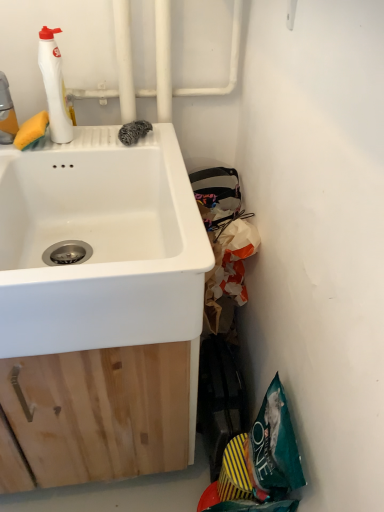
Question: Is teal fabric bag at lower right further to camera compared to translucent white bottle at upper left, which is the 1th cleaning product from left to right?

Choices:
 (A) no
 (B) yes

Answer: (B)

Question: Does teal fabric bag at lower right have a greater width compared to translucent white bottle at upper left, which ranks as the 2th cleaning product in right-to-left order?

Choices:
 (A) no
 (B) yes

Answer: (A)

Question: Is teal fabric bag at lower right smaller than translucent white bottle at upper left, which is the 1th cleaning product from left to right?

Choices:
 (A) no
 (B) yes

Answer: (A)

Question: Can you confirm if teal fabric bag at lower right is shorter than translucent white bottle at upper left, which is the 1th cleaning product from left to right?

Choices:
 (A) no
 (B) yes

Answer: (A)

Question: From the image's perspective, is teal fabric bag at lower right over translucent white bottle at upper left, which is the 1th cleaning product from left to right?

Choices:
 (A) yes
 (B) no

Answer: (B)

Question: Is teal fabric bag at lower right closer to camera compared to translucent white bottle at upper left, which is the 1th cleaning product from left to right?

Choices:
 (A) no
 (B) yes

Answer: (A)

Question: From the image's perspective, is white matte bottle at upper left, which ranks as the second cleaning product in left-to-right order, beneath teal fabric bag at lower right?

Choices:
 (A) yes
 (B) no

Answer: (B)

Question: From the image's perspective, does white matte bottle at upper left, which is the first cleaning product in right-to-left order, appear higher than teal fabric bag at lower right?

Choices:
 (A) yes
 (B) no

Answer: (A)

Question: Is white matte bottle at upper left, which ranks as the second cleaning product in left-to-right order, to the right of teal fabric bag at lower right from the viewer's perspective?

Choices:
 (A) no
 (B) yes

Answer: (A)

Question: Is white matte bottle at upper left, which is the first cleaning product in right-to-left order, outside teal fabric bag at lower right?

Choices:
 (A) no
 (B) yes

Answer: (B)

Question: Is white matte bottle at upper left, which ranks as the second cleaning product in left-to-right order, to the left of teal fabric bag at lower right from the viewer's perspective?

Choices:
 (A) no
 (B) yes

Answer: (B)

Question: Would you say teal fabric bag at lower right is part of white matte bottle at upper left, which is the first cleaning product in right-to-left order,'s contents?

Choices:
 (A) no
 (B) yes

Answer: (A)

Question: Can you confirm if translucent white bottle at upper left, which ranks as the 2th cleaning product in right-to-left order, is taller than white matte bottle at upper left, which is the first cleaning product in right-to-left order?

Choices:
 (A) no
 (B) yes

Answer: (A)